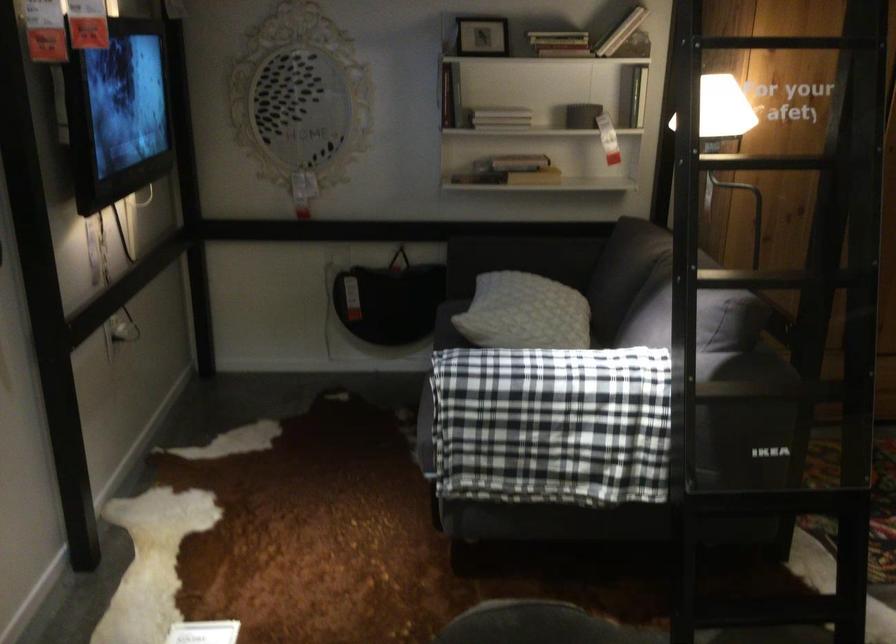
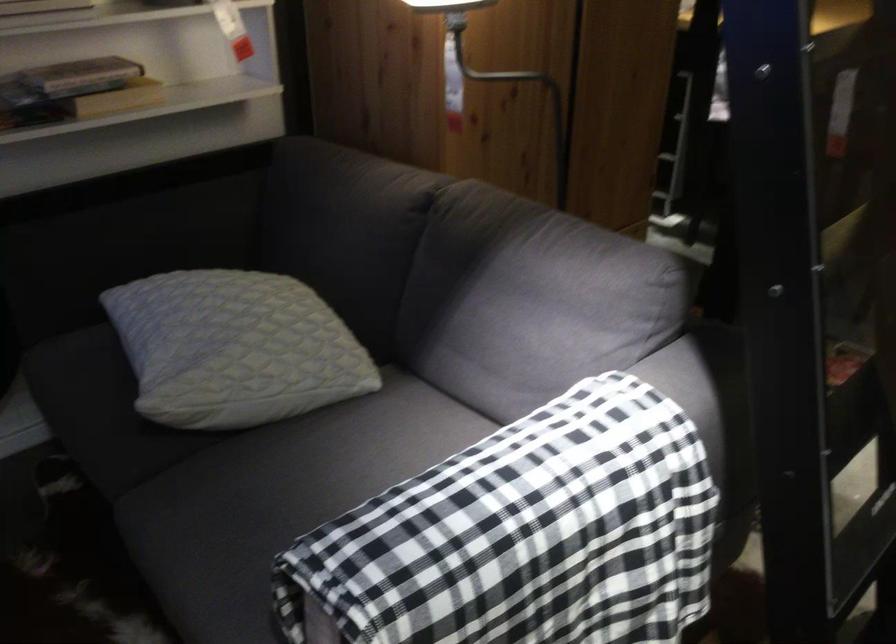
Locate, in the second image, the point that corresponds to (x=785, y=172) in the first image.

(500, 71)